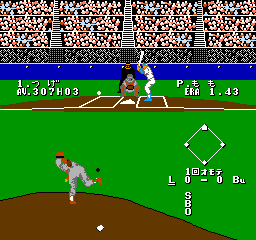
Find the location of a particular element. The height and width of the screenshot is (240, 256). fans in stand on left is located at coordinates (25, 39).